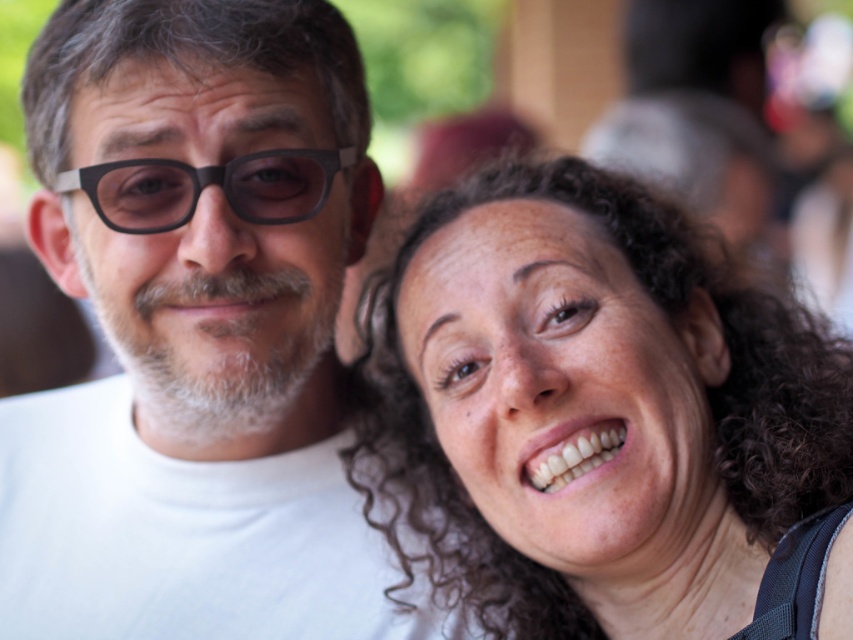
Who is higher up, curly hair at upper right or black plastic glasses at upper left?

black plastic glasses at upper left is higher up.

Does curly hair at upper right have a lesser height compared to black plastic glasses at upper left?

Incorrect, curly hair at upper right's height does not fall short of black plastic glasses at upper left's.

The width and height of the screenshot is (853, 640). In order to click on curly hair at upper right in this screenshot , I will do `click(592, 410)`.

Does white matte t-shirt at left appear under black plastic glasses at upper left?

Yes, white matte t-shirt at left is below black plastic glasses at upper left.

Is point (228, 628) positioned behind point (238, 205)?

Yes, point (228, 628) is behind point (238, 205).

This screenshot has width=853, height=640. What do you see at coordinates (196, 333) in the screenshot? I see `white matte t-shirt at left` at bounding box center [196, 333].

Locate an element on the screen. This screenshot has height=640, width=853. white matte t-shirt at left is located at coordinates [196, 333].

Can you confirm if white matte t-shirt at left is positioned below curly hair at upper right?

No, white matte t-shirt at left is not below curly hair at upper right.

Is white matte t-shirt at left taller than curly hair at upper right?

Indeed, white matte t-shirt at left has a greater height compared to curly hair at upper right.

Is point (241, 570) closer to camera compared to point (675, 412)?

That is False.

Where is `white matte t-shirt at left`? The width and height of the screenshot is (853, 640). white matte t-shirt at left is located at coordinates (196, 333).